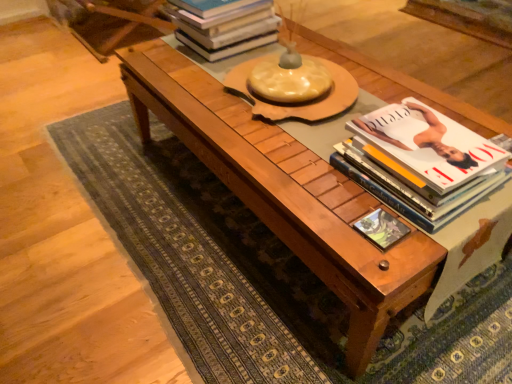
Locate an element on the screen. free space behind matte green book at center is located at coordinates point(343,190).